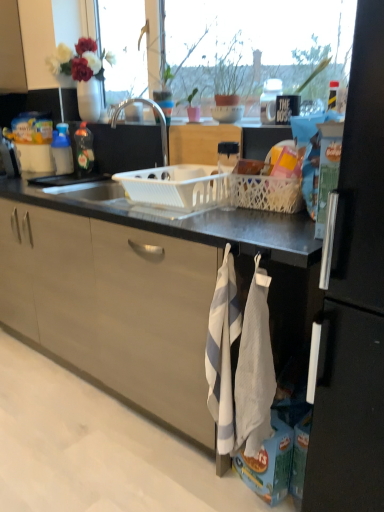
Question: Based on their sizes in the image, would you say white textured hand towel at lower center, which is the first hand towel from left to right, is bigger or smaller than translucent plastic bottle at left, which appears as the 2th kitchen appliance when viewed from the left?

Choices:
 (A) small
 (B) big

Answer: (B)

Question: From the image's perspective, is white textured hand towel at lower center, acting as the second hand towel starting from the right, located above or below translucent plastic bottle at left, acting as the first kitchen appliance starting from the right?

Choices:
 (A) above
 (B) below

Answer: (B)

Question: Which is farther from the white plastic basket at center?

Choices:
 (A) matte black mug at upper center
 (B) white plastic basket at center, which is the 2th basket from right to left
 (C) white textured hand towel at lower center, acting as the second hand towel starting from the right
 (D) matte silver faucet at center
 (E) blue plastic bottle at left, placed as the 1th kitchen appliance when sorted from left to right

Answer: (E)

Question: Estimate the real-world distances between objects in this image. Which object is closer to the translucent plastic bottle at left, which appears as the 2th kitchen appliance when viewed from the left?

Choices:
 (A) black matte refrigerator at right
 (B) white textured hand towel at lower right, which ranks as the 1th hand towel in right-to-left order
 (C) green matte plant at upper center
 (D) white textured hand towel at lower center, acting as the second hand towel starting from the right
 (E) white plastic basket at center

Answer: (E)